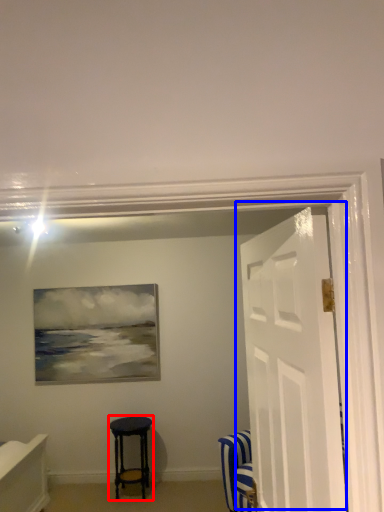
Question: Which object appears closest to the camera in this image, stool (highlighted by a red box) or door (highlighted by a blue box)?

Choices:
 (A) stool
 (B) door

Answer: (B)